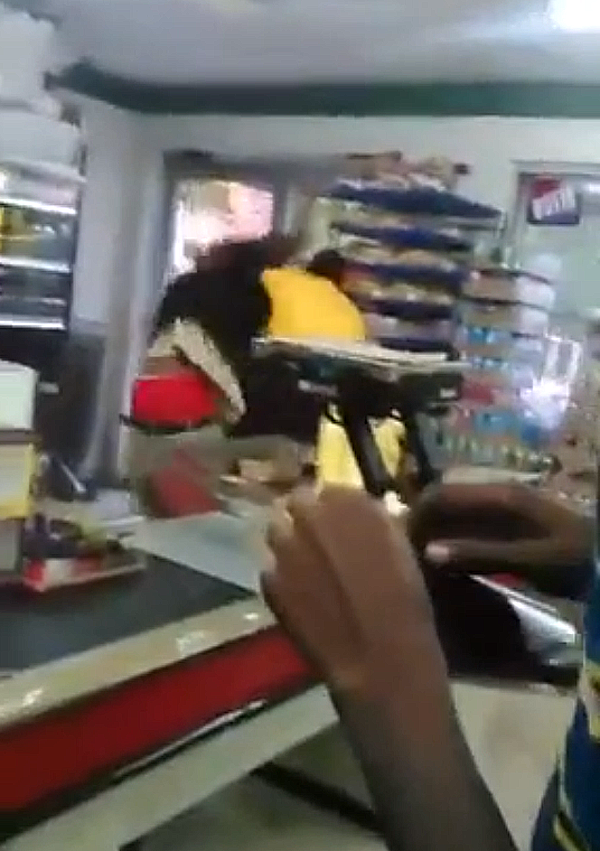
You are a GUI agent. You are given a task and a screenshot of the screen. Output one action in this format:
    pyautogui.click(x=<x>, y=<y>)
    Task: Click on the top frame of door
    
    Given the screenshot: What is the action you would take?
    pyautogui.click(x=250, y=166)